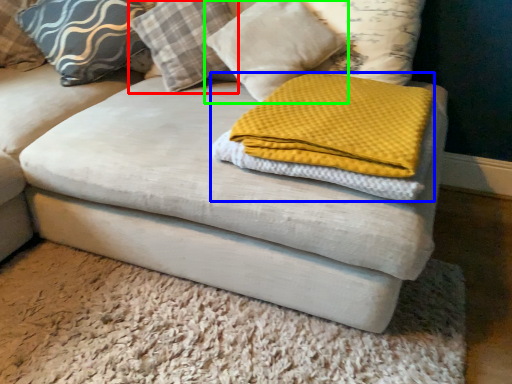
Question: Which object is the closest to the pillow (highlighted by a red box)? Choose among these: cloth (highlighted by a blue box) or pillow (highlighted by a green box).

Choices:
 (A) cloth
 (B) pillow

Answer: (B)